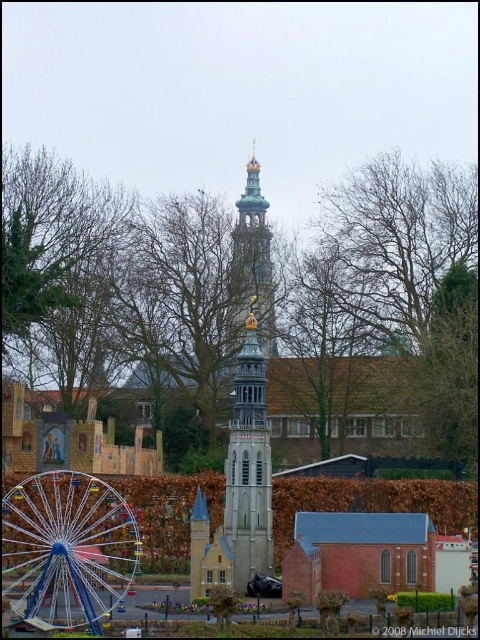
Between bare branches at upper center and blue metallic ferris wheel at lower left, which one is positioned higher?

bare branches at upper center is above.

Is bare branches at upper center further to camera compared to blue metallic ferris wheel at lower left?

Yes.

Is point (340, 305) positioned behind point (28, 538)?

Yes, point (340, 305) is behind point (28, 538).

Find the location of a particular element. Image resolution: width=480 pixels, height=640 pixels. bare branches at upper center is located at coordinates (x=398, y=241).

Is bare branches at upper center shorter than stone tower at center?

Indeed, bare branches at upper center has a lesser height compared to stone tower at center.

Between bare branches at upper center and stone tower at center, which one is positioned higher?

bare branches at upper center is higher up.

Is point (471, 202) farther from camera compared to point (241, 413)?

That is True.

The image size is (480, 640). In order to click on bare branches at upper center in this screenshot , I will do `click(398, 241)`.

Can you confirm if stone tower at center is smaller than gold/gilded metal tower at center?

No.

Who is positioned more to the right, stone tower at center or gold/gilded metal tower at center?

Positioned to the right is gold/gilded metal tower at center.

This screenshot has width=480, height=640. In order to click on stone tower at center in this screenshot , I will do `click(249, 467)`.